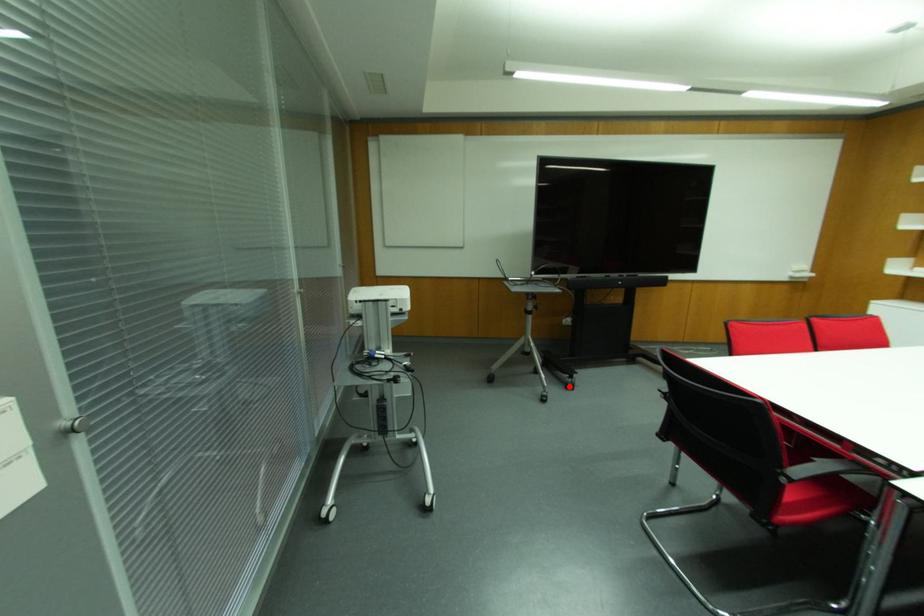
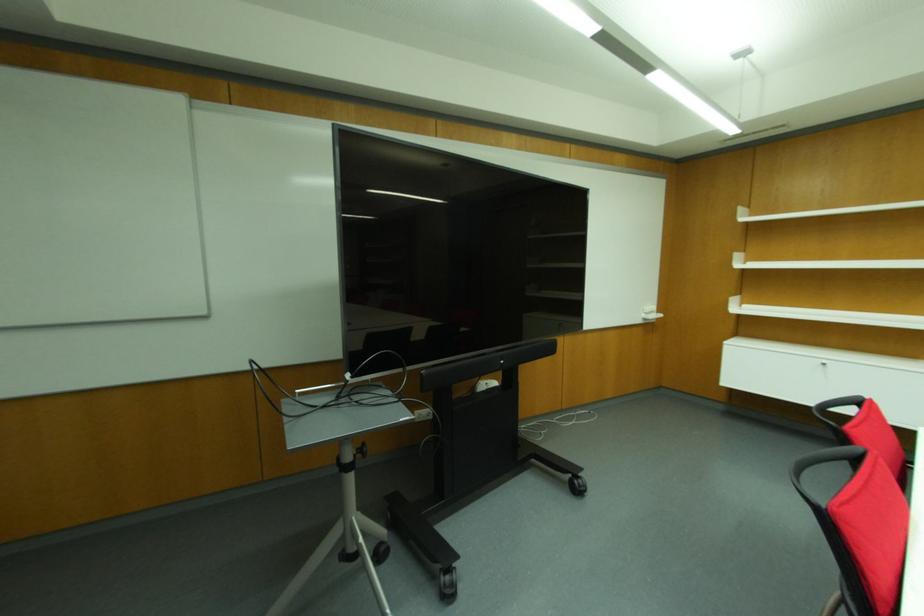
Question: I am providing you with two images of the same scene from different viewpoints. A red point is shown in image1. For the corresponding object point in image2, is it positioned nearer or farther from the camera?

Choices:
 (A) Nearer
 (B) Farther

Answer: (B)